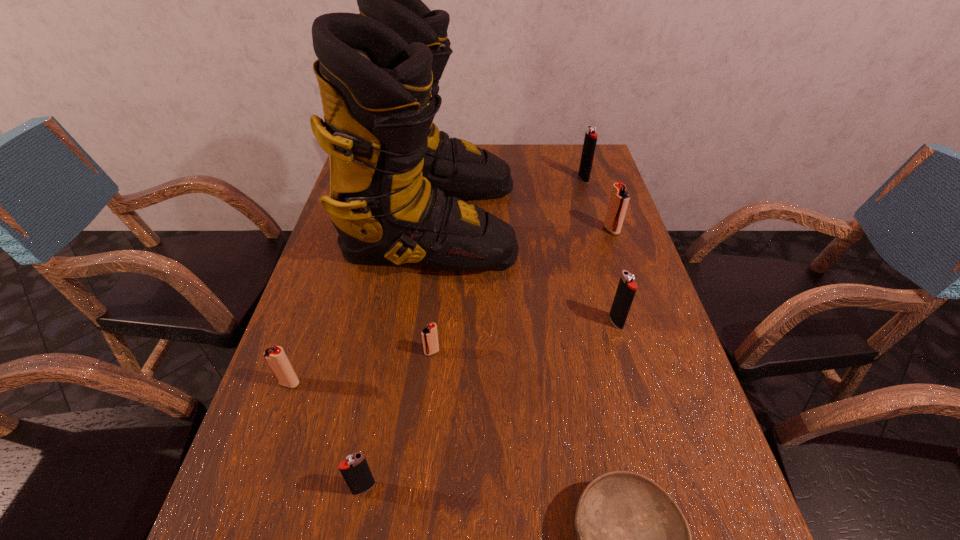
Locate an element on the screen. object that is the fifth closest to the second shortest object is located at coordinates (626, 289).

Locate which object is the sixth closest to the seventh tallest object. Please provide its 2D coordinates. Your answer should be formatted as a tuple, i.e. [(x, y)], where the tuple contains the x and y coordinates of a point satisfying the conditions above.

[(619, 199)]

This screenshot has height=540, width=960. Find the location of `igniter that stands as the fifth closest to the second farthest red igniter`. igniter that stands as the fifth closest to the second farthest red igniter is located at coordinates (590, 140).

Identify which igniter is the third nearest to the second nearest black igniter. Please provide its 2D coordinates. Your answer should be formatted as a tuple, i.e. [(x, y)], where the tuple contains the x and y coordinates of a point satisfying the conditions above.

[(590, 140)]

The image size is (960, 540). Identify the location of black igniter that can be found as the second closest to the rightmost igniter. (626, 289).

Select which black igniter is the third closest to the fourth igniter from right to left. Please provide its 2D coordinates. Your answer should be formatted as a tuple, i.e. [(x, y)], where the tuple contains the x and y coordinates of a point satisfying the conditions above.

[(590, 140)]

Find the location of a particular element. Image resolution: width=960 pixels, height=540 pixels. red igniter that can be found as the second closest to the third igniter from left to right is located at coordinates (619, 199).

Identify which red igniter is the third closest to the gray bowl. Please provide its 2D coordinates. Your answer should be formatted as a tuple, i.e. [(x, y)], where the tuple contains the x and y coordinates of a point satisfying the conditions above.

[(619, 199)]